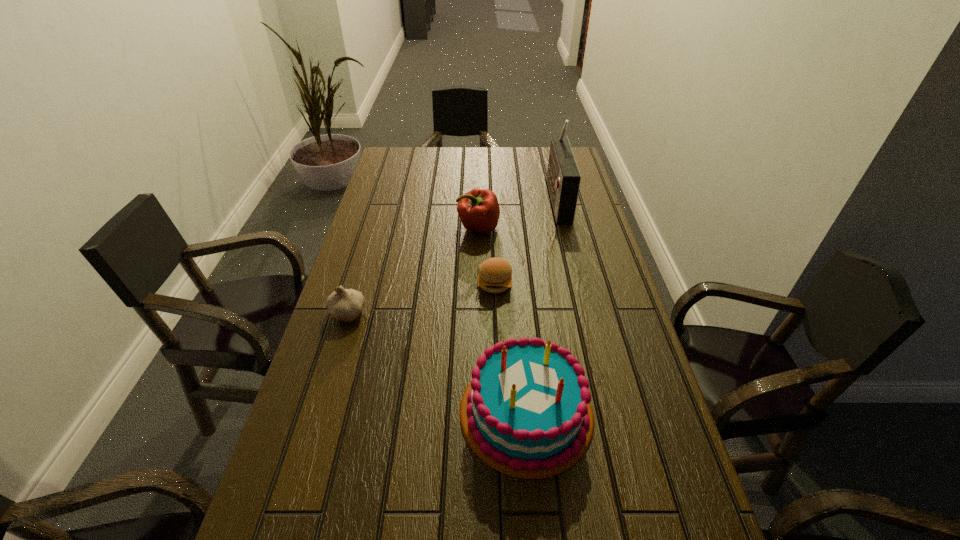
Find the location of a particular element. The height and width of the screenshot is (540, 960). free spot located on the front panel of the rightmost object is located at coordinates (462, 198).

The image size is (960, 540). In order to click on vacant space located on the front panel of the rightmost object in this screenshot , I will do `click(489, 198)`.

Identify the location of blank space located 0.250m on the left of the birthday cake. Image resolution: width=960 pixels, height=540 pixels. (348, 412).

Find the location of a particular element. free space located 0.170m on the left of the third tallest object is located at coordinates (408, 228).

Where is `free space located 0.080m on the back of the leftmost object`? The image size is (960, 540). free space located 0.080m on the back of the leftmost object is located at coordinates (357, 281).

Locate an element on the screen. The width and height of the screenshot is (960, 540). vacant region located 0.200m on the front of the hamburger is located at coordinates (497, 352).

In order to click on object present at the left edge in this screenshot , I will do `click(344, 305)`.

The width and height of the screenshot is (960, 540). In order to click on radio receiver that is at the right edge in this screenshot , I will do `click(563, 177)`.

You are a GUI agent. You are given a task and a screenshot of the screen. Output one action in this format:
    pyautogui.click(x=<x>, y=<y>)
    Task: Click on the birthday cake located at the right edge
    
    Given the screenshot: What is the action you would take?
    pyautogui.click(x=526, y=413)

The image size is (960, 540). Identify the location of blank space at the far edge of the desktop. (437, 160).